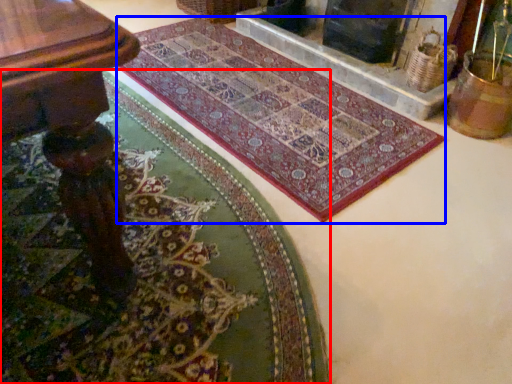
Question: Which object is further to the camera taking this photo, mat (highlighted by a red box) or mat (highlighted by a blue box)?

Choices:
 (A) mat
 (B) mat

Answer: (B)